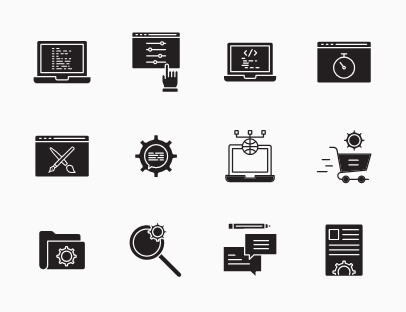
Find the location of a particular element. The height and width of the screenshot is (312, 406). laptop lids is located at coordinates (79, 47), (80, 79), (231, 55), (230, 77), (236, 176), (233, 153).